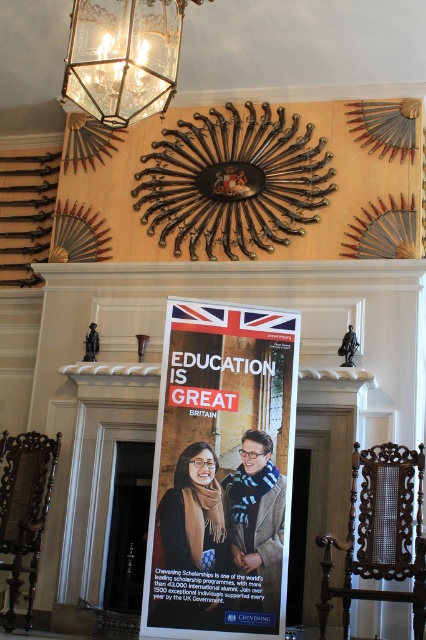
You are an interior designer planning to hang a new artwork between the white paper poster at center and the clear glass lantern at upper center. Based on their positions, where should you place the new artwork to maintain symmetry?

The white paper poster at center is below the clear glass lantern at upper center, so placing the new artwork between them would require positioning it either above the poster but below the lantern or centered between them to maintain symmetry.

You are an interior designer planning to hang a new artwork between the white paper poster at center and the clear glass lantern at upper center. Given their sizes, which object should you place closer to the viewer to maintain visual balance?

The white paper poster at center is larger than the clear glass lantern at upper center. To maintain visual balance, place the smaller clear glass lantern at upper center closer to the viewer while positioning the larger white paper poster at center further back.

You are an interior designer planning to hang a new artwork between the white paper poster at center and the clear glass lantern at upper center. Given their sizes, which object should you place closer to the edge to maintain balance?

The white paper poster at center is wider than the clear glass lantern at upper center. To maintain balance, place the wider poster closer to the edge so that the smaller lantern can be positioned centrally.